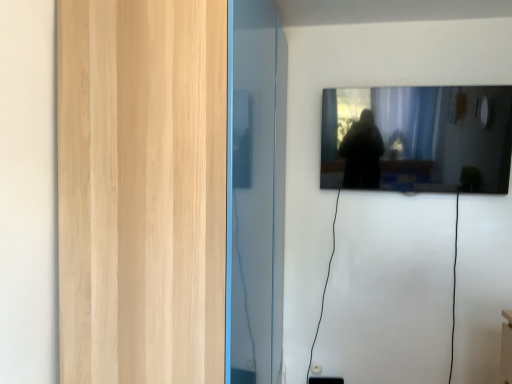
Question: Is transparent glass door at left shorter than black glossy mirror at upper right?

Choices:
 (A) no
 (B) yes

Answer: (A)

Question: Is transparent glass door at left at the left side of black glossy mirror at upper right?

Choices:
 (A) yes
 (B) no

Answer: (A)

Question: Does transparent glass door at left come in front of black glossy mirror at upper right?

Choices:
 (A) no
 (B) yes

Answer: (B)

Question: Considering the relative sizes of transparent glass door at left and black glossy mirror at upper right in the image provided, is transparent glass door at left bigger than black glossy mirror at upper right?

Choices:
 (A) no
 (B) yes

Answer: (B)

Question: Considering the relative positions of transparent glass door at left and black glossy mirror at upper right in the image provided, is transparent glass door at left behind black glossy mirror at upper right?

Choices:
 (A) yes
 (B) no

Answer: (B)

Question: Considering the relative sizes of transparent glass door at left and black glossy mirror at upper right in the image provided, is transparent glass door at left smaller than black glossy mirror at upper right?

Choices:
 (A) no
 (B) yes

Answer: (A)

Question: Considering the relative positions of black glossy mirror at upper right and transparent glass door at left in the image provided, is black glossy mirror at upper right in front of transparent glass door at left?

Choices:
 (A) no
 (B) yes

Answer: (A)

Question: Is black glossy mirror at upper right oriented away from transparent glass door at left?

Choices:
 (A) no
 (B) yes

Answer: (A)

Question: From a real-world perspective, is black glossy mirror at upper right located higher than transparent glass door at left?

Choices:
 (A) no
 (B) yes

Answer: (B)

Question: From the image's perspective, is black glossy mirror at upper right located beneath transparent glass door at left?

Choices:
 (A) no
 (B) yes

Answer: (A)

Question: From the image's perspective, is black glossy mirror at upper right over transparent glass door at left?

Choices:
 (A) yes
 (B) no

Answer: (A)

Question: Are black glossy mirror at upper right and transparent glass door at left making contact?

Choices:
 (A) yes
 (B) no

Answer: (B)

Question: Is transparent glass door at left situated inside black glossy mirror at upper right or outside?

Choices:
 (A) outside
 (B) inside

Answer: (A)